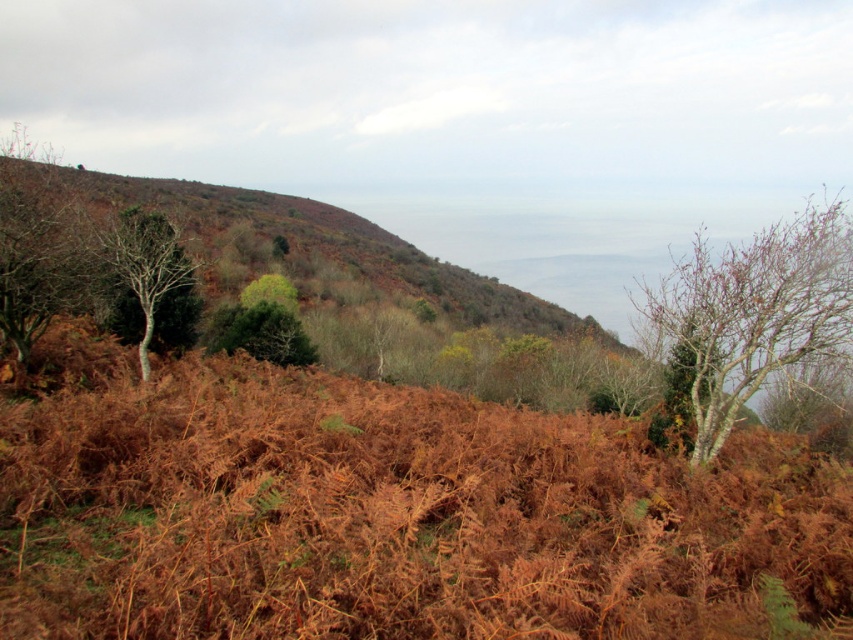
Question: Does brown/dry grass at left appear under green matte tree at left?

Choices:
 (A) no
 (B) yes

Answer: (A)

Question: Among these points, which one is nearest to the camera?

Choices:
 (A) (149, 228)
 (B) (239, 209)
 (C) (790, 298)

Answer: (C)

Question: Which object is the closest to the bare wood tree at right?

Choices:
 (A) brown/dry grass at left
 (B) green matte tree at left

Answer: (B)

Question: Which point appears farthest from the camera in this image?

Choices:
 (A) (763, 260)
 (B) (141, 358)

Answer: (B)

Question: In this image, where is brown/dry grass at left located relative to green matte tree at left?

Choices:
 (A) right
 (B) left

Answer: (A)

Question: Is bare wood tree at right below green matte tree at left?

Choices:
 (A) no
 (B) yes

Answer: (A)